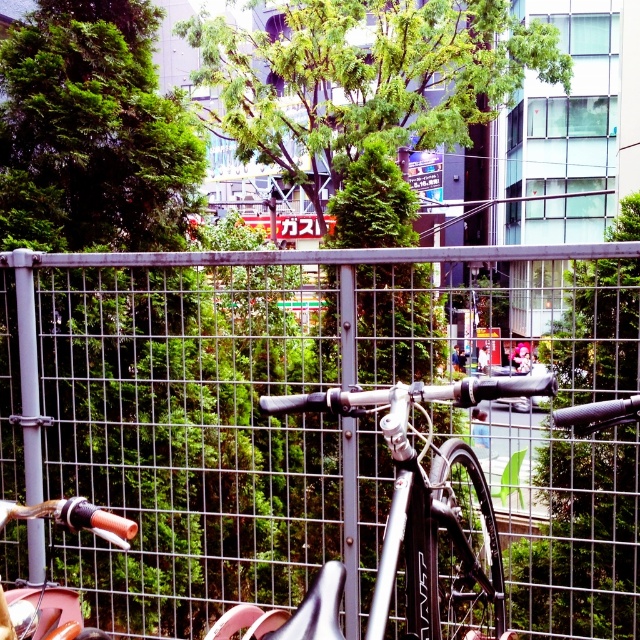
You are a photographer standing 1.5 meters away from the metal mesh fence at center. You want to take a photo of the building behind the fence. Will the fence block the entire view of the building in your photo?

The metal mesh fence at center is 1.68 meters away from the camera. Since you are standing 1.5 meters away from the fence, you are closer to the fence than its distance from the camera. This means the fence will block part of the view of the building behind it in your photo.

You are standing in an urban park and want to take a photo of the metal mesh fence at center. Based on the scene description, where should you position yourself to capture the fence in the frame?

The metal mesh fence at center is located at point [314,420], so you should position yourself directly in front of that coordinate to ensure the fence is centered in your photo.